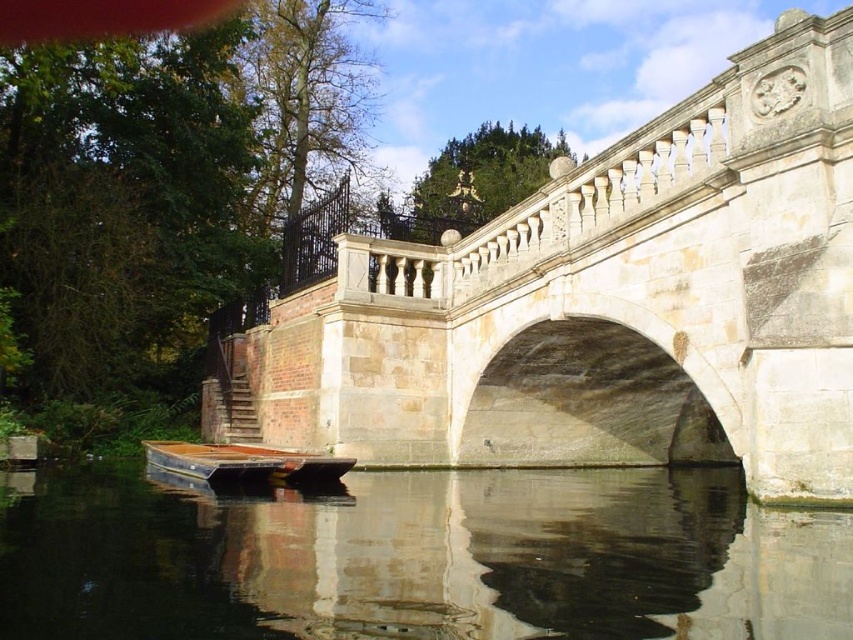
From the picture: You are standing at the point marked by the coordinates point (598, 305) in the image. What structure are you currently on?

You are standing on the stone bridge at center, as the point (598, 305) represents the stone bridge at center in the image.